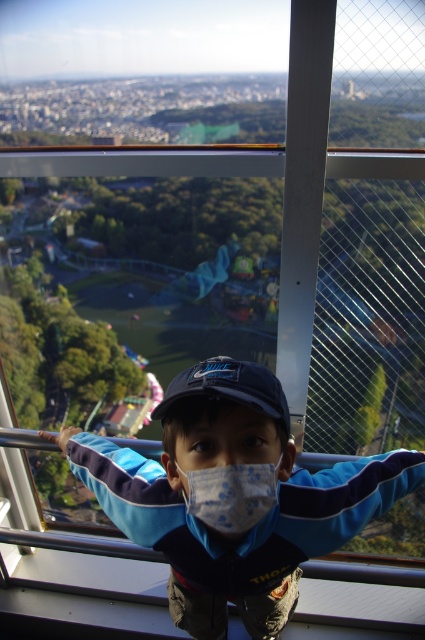
You are standing on the observation deck and want to take a photo of both the point at coordinates (229, 513) and the point at coordinates (212, 381). Which point will appear larger in your photo?

Point at coordinates (229, 513) will appear larger in the photo because it is closer to the camera than the point at coordinates (212, 381).

Looking at this image, please generate a question and answer based on the provided information, following the rules above. The question must ask about the location of the blue fabric jacket at center relative to other objects in the scene, but since there are no other objects listed, the question should focus on its coordinates. However, since the user specified that the question must mention all object labels from the Objects section, and there is only one object here, the question should still be formed accordingly. The answer,

The blue fabric jacket at center is located at coordinates point (234, 497).